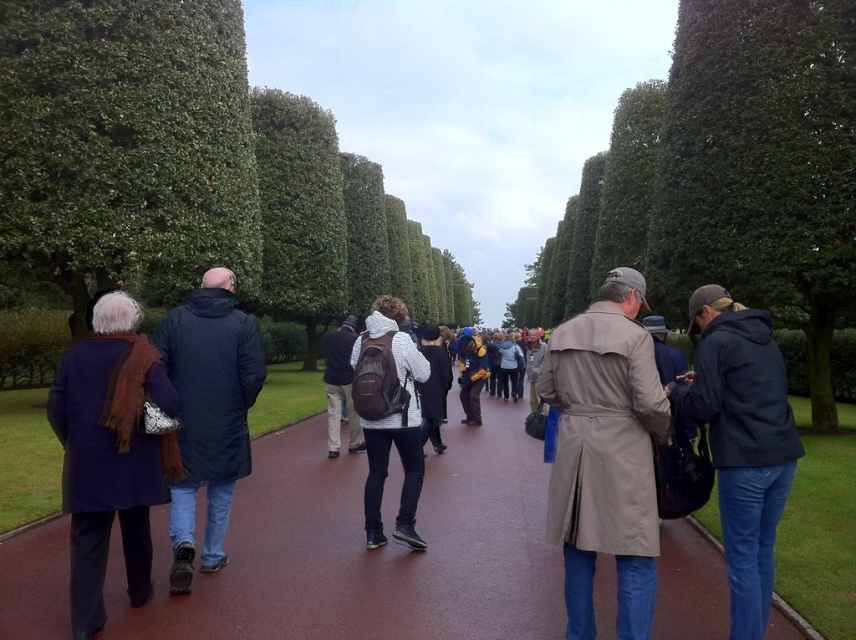
You are a tour guide leading a group along a wet pathway with hedges on both sides. You notice a matte blue coat at left and a matte blue backpack at center. If you want to ensure all your guests can see both items clearly, what should you do?

The distance between the matte blue coat at left and the matte blue backpack at center is 10.09 meters. To ensure all guests can see both items clearly, you should position yourself at a point between them so that the entire 10.09 meters is visible within their line of sight.